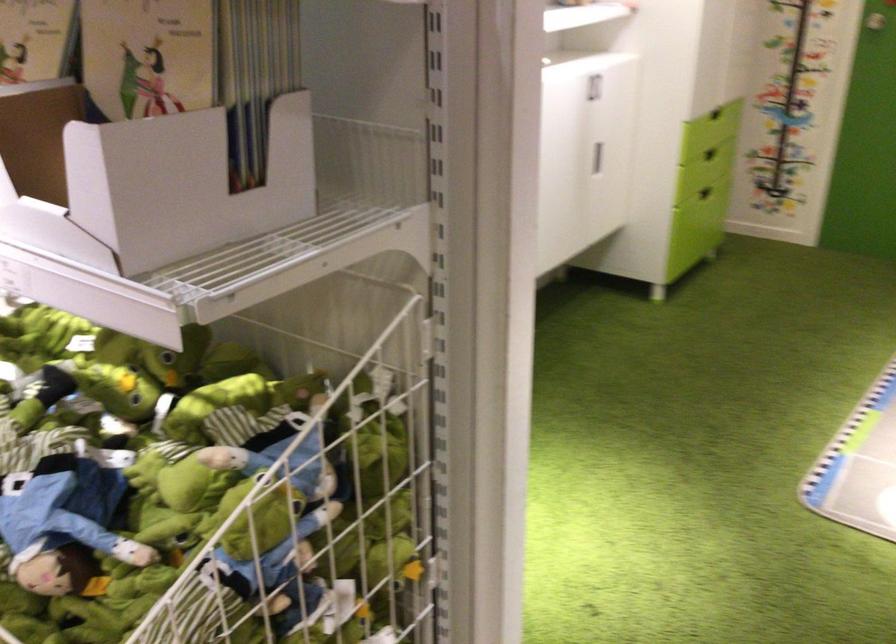
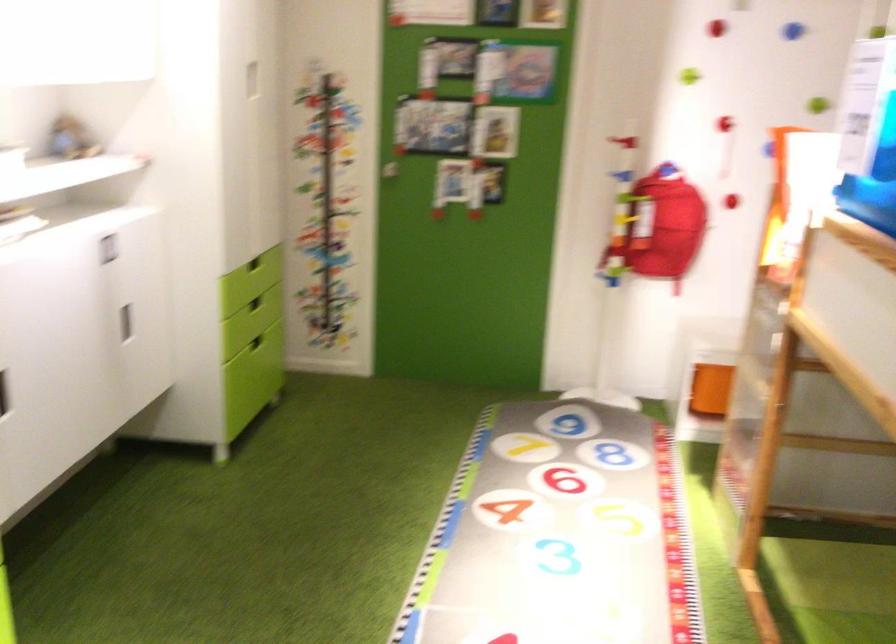
In the second image, find the point that corresponds to the point at 720,109 in the first image.

(254, 263)